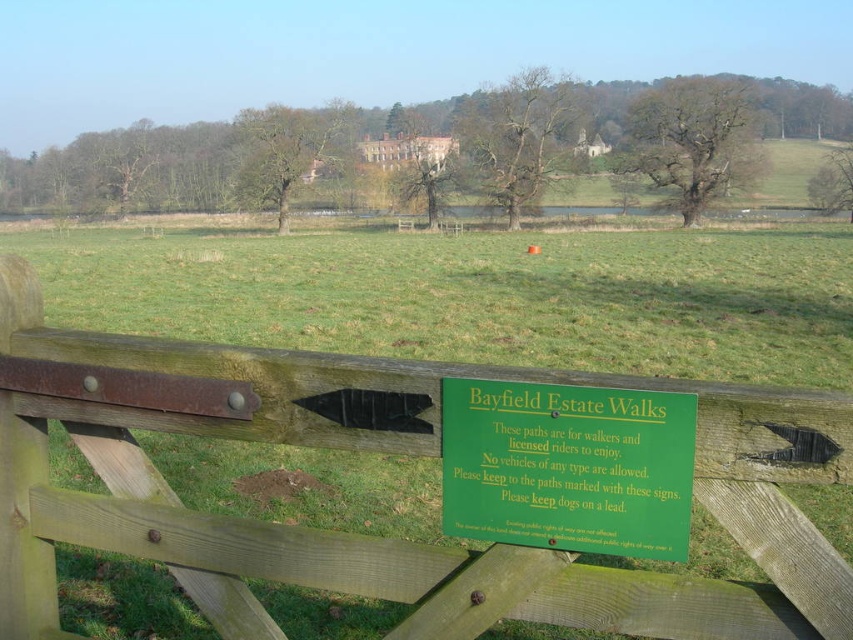
Question: Can you confirm if green wooden fence at center is positioned to the right of green plastic sign at center?

Choices:
 (A) no
 (B) yes

Answer: (A)

Question: Can you confirm if green wooden fence at center is smaller than green plastic sign at center?

Choices:
 (A) no
 (B) yes

Answer: (A)

Question: Is green wooden fence at center behind green plastic sign at center?

Choices:
 (A) no
 (B) yes

Answer: (A)